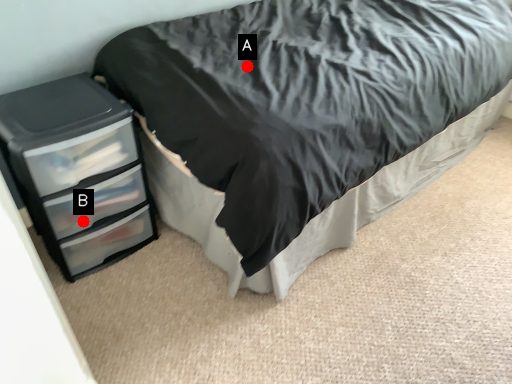
Question: Two points are circled on the image, labeled by A and B beside each circle. Which of the following is the farthest from the observer?

Choices:
 (A) A is further
 (B) B is further

Answer: (B)